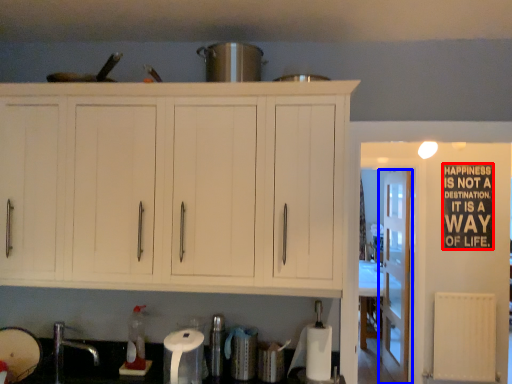
Question: Which object appears farthest to the camera in this image, bulletin board (highlighted by a red box) or door (highlighted by a blue box)?

Choices:
 (A) bulletin board
 (B) door

Answer: (B)